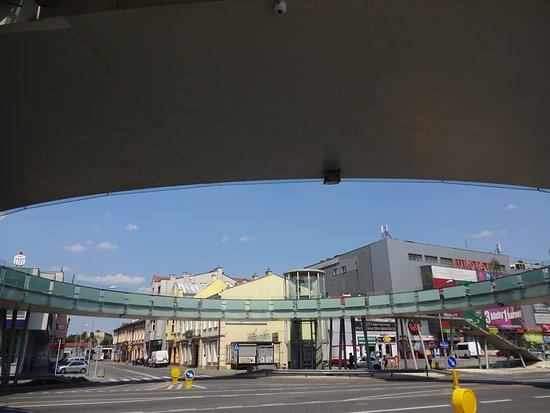
At what (x,y) coordinates should I click in order to perform the action: click on ceiling. Please return your answer as a coordinate pair (x, y). Image resolution: width=550 pixels, height=413 pixels. Looking at the image, I should click on (280, 147).